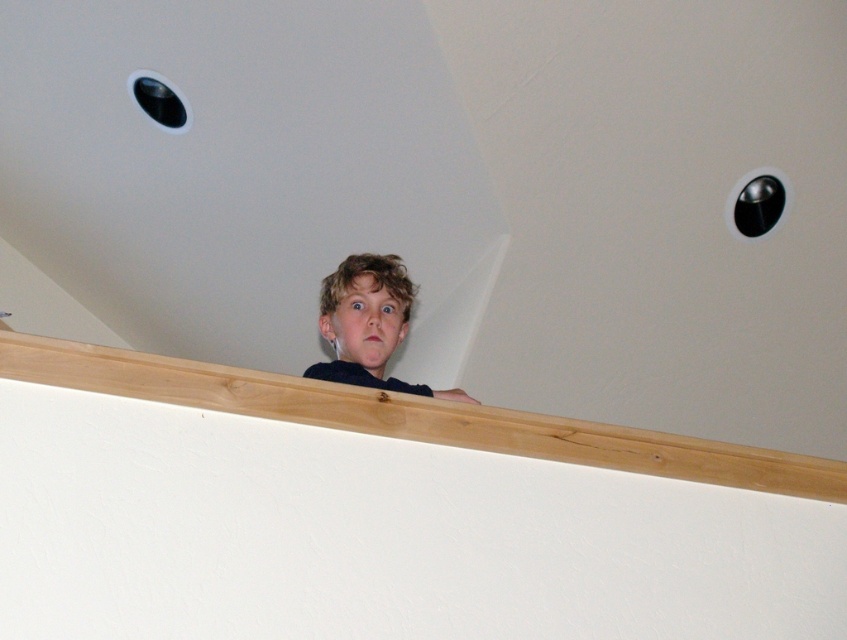
Question: Considering the relative positions of light brown wood at upper center and black plastic hole at upper left in the image provided, where is light brown wood at upper center located with respect to black plastic hole at upper left?

Choices:
 (A) right
 (B) left

Answer: (A)

Question: Estimate the real-world distances between objects in this image. Which object is closer to the black plastic hole at upper left?

Choices:
 (A) light brown wood at upper center
 (B) metallic circular hole at upper right
 (C) curly-haired boy at center

Answer: (C)

Question: Which of the following is the closest to the observer?

Choices:
 (A) black plastic hole at upper left
 (B) curly-haired boy at center
 (C) metallic circular hole at upper right

Answer: (B)

Question: Which of the following is the farthest from the observer?

Choices:
 (A) light brown wood at upper center
 (B) curly-haired boy at center
 (C) black plastic hole at upper left

Answer: (C)

Question: Is curly-haired boy at center further to the viewer compared to black plastic hole at upper left?

Choices:
 (A) no
 (B) yes

Answer: (A)

Question: Can you confirm if metallic circular hole at upper right is wider than black plastic hole at upper left?

Choices:
 (A) no
 (B) yes

Answer: (A)